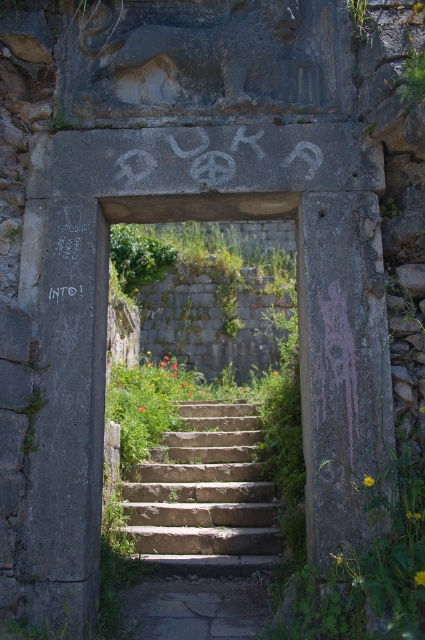
You are standing in front of the weathered stone doorway and want to walk up the stairs. Which set of stairs should you approach first, the stone steps at center or the natural stone stairs at center?

You should approach the stone steps at center first because it is closer to the viewer than the natural stone stairs at center.

You are a hiker standing at the base of the stone steps at center and natural stone stairs at center. You want to reach the top of the doorway. Which path should you take to minimize the distance traveled?

The stone steps at center is 5.98 feet closer to the top of the doorway than the natural stone stairs at center, so taking the stone steps at center would minimize the distance traveled.